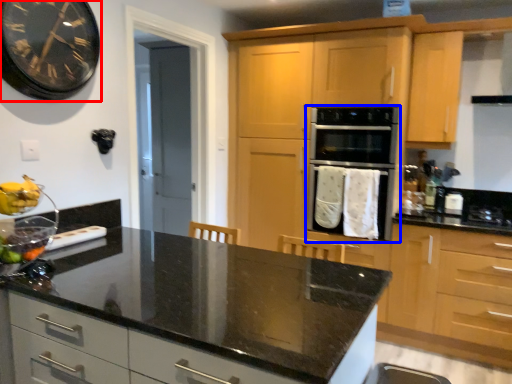
Question: Among these objects, which one is nearest to the camera, clock (highlighted by a red box) or oven (highlighted by a blue box)?

Choices:
 (A) clock
 (B) oven

Answer: (A)